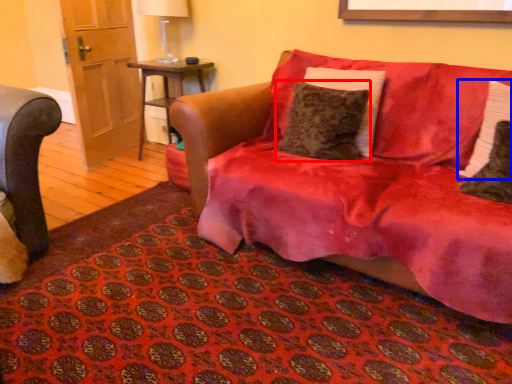
Question: Which object appears closest to the camera in this image, pillow (highlighted by a red box) or pillow (highlighted by a blue box)?

Choices:
 (A) pillow
 (B) pillow

Answer: (B)